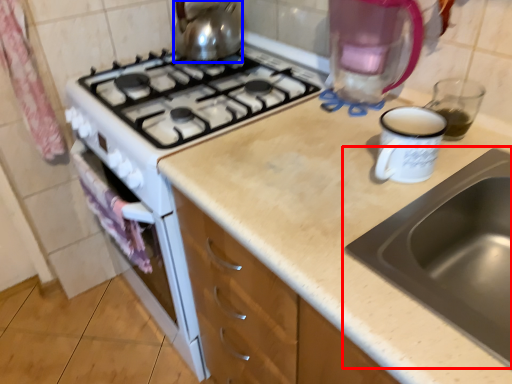
Question: Which point is further to the camera, sink (highlighted by a red box) or kitchen appliance (highlighted by a blue box)?

Choices:
 (A) sink
 (B) kitchen appliance

Answer: (B)